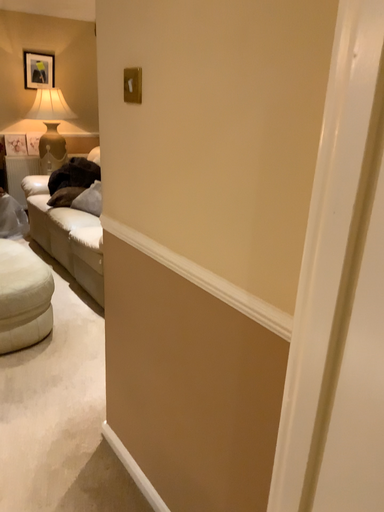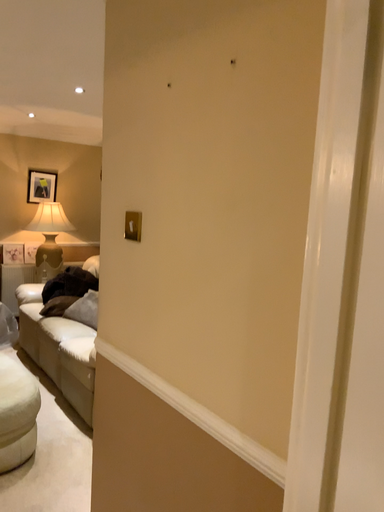
Question: How did the camera likely rotate when shooting the video?

Choices:
 (A) rotated upward
 (B) rotated downward

Answer: (A)